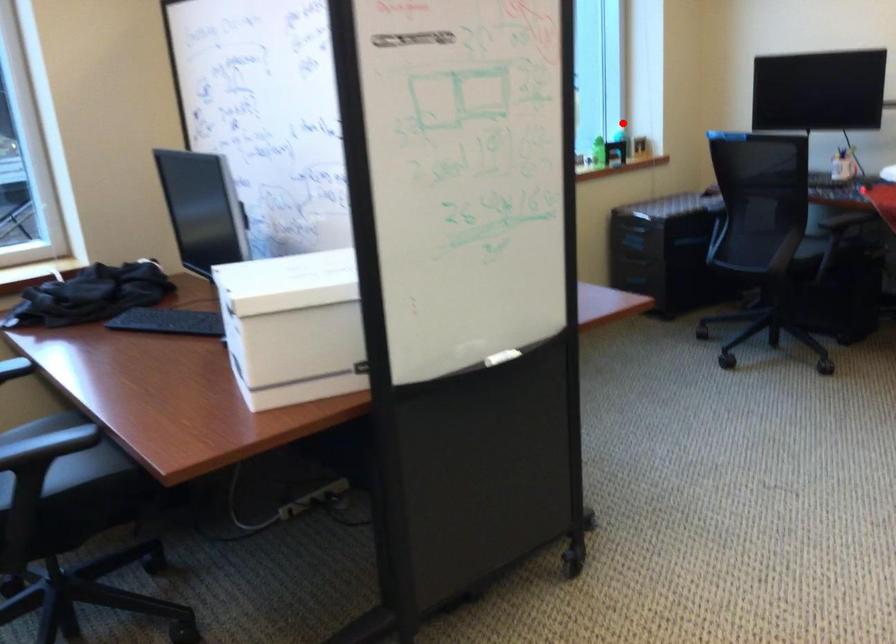
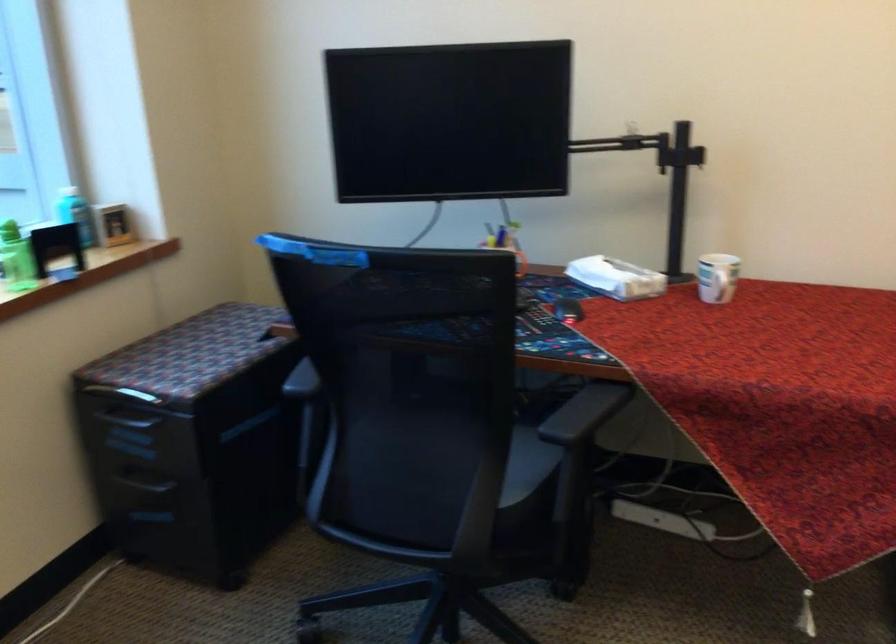
In the second image, find the point that corresponds to the highlighted location in the first image.

(74, 214)